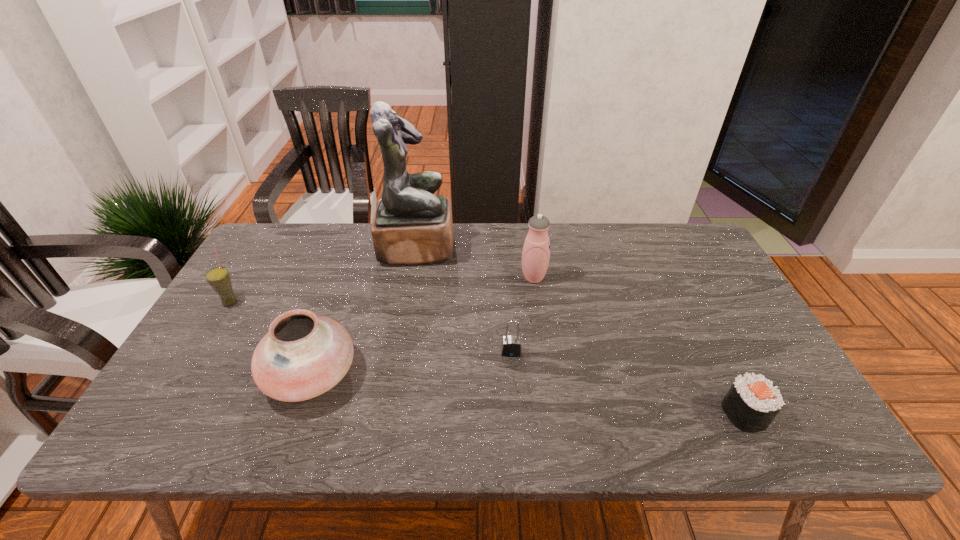
Where is `the shortest object`? Image resolution: width=960 pixels, height=540 pixels. the shortest object is located at coordinates (752, 402).

Where is `vacant position located 0.100m in a relaxed pose on the tallest object`? Image resolution: width=960 pixels, height=540 pixels. vacant position located 0.100m in a relaxed pose on the tallest object is located at coordinates (485, 247).

Locate an element on the screen. vacant space located on the back of the thermos bottle is located at coordinates (527, 234).

This screenshot has width=960, height=540. Find the location of `vacant space located on the right of the third farthest object`. vacant space located on the right of the third farthest object is located at coordinates (350, 302).

Find the location of `vacant space located on the left of the pottery`. vacant space located on the left of the pottery is located at coordinates click(x=244, y=374).

Image resolution: width=960 pixels, height=540 pixels. In order to click on free space located on the shackle of the padlock in this screenshot , I will do [516, 427].

Image resolution: width=960 pixels, height=540 pixels. In order to click on vacant point located 0.060m on the back of the sushi in this screenshot , I will do pos(725,373).

This screenshot has height=540, width=960. In order to click on object that is at the far edge in this screenshot , I will do `click(411, 226)`.

This screenshot has width=960, height=540. I want to click on pottery located in the near edge section of the desktop, so click(x=302, y=356).

Where is `sushi situated at the near edge`? sushi situated at the near edge is located at coordinates (752, 402).